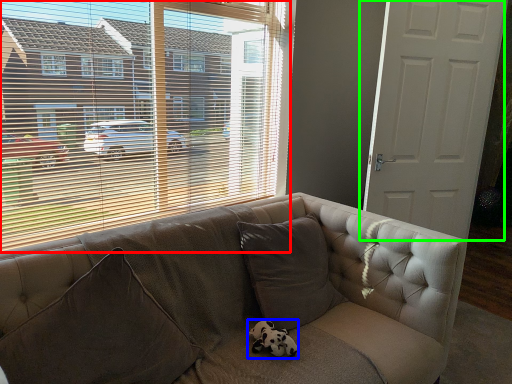
Question: Considering the real-world distances, which object is farthest from window (highlighted by a red box)? animal (highlighted by a blue box) or door (highlighted by a green box)?

Choices:
 (A) animal
 (B) door

Answer: (A)